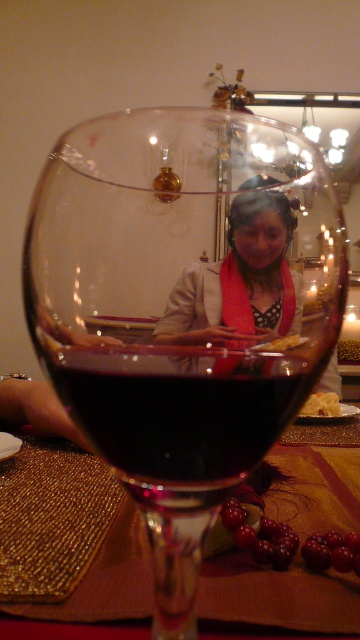
Does shiny dark red wine at center appear on the right side of shiny gold placemat at center?

Incorrect, shiny dark red wine at center is not on the right side of shiny gold placemat at center.

Based on the photo, does shiny dark red wine at center lie behind shiny gold placemat at center?

No, shiny dark red wine at center is closer to the viewer.

Is point (173, 426) behind point (321, 518)?

No, it is not.

At what (x,y) coordinates should I click in order to perform the action: click on shiny dark red wine at center. Please return your answer as a coordinate pair (x, y). Looking at the image, I should click on (178, 410).